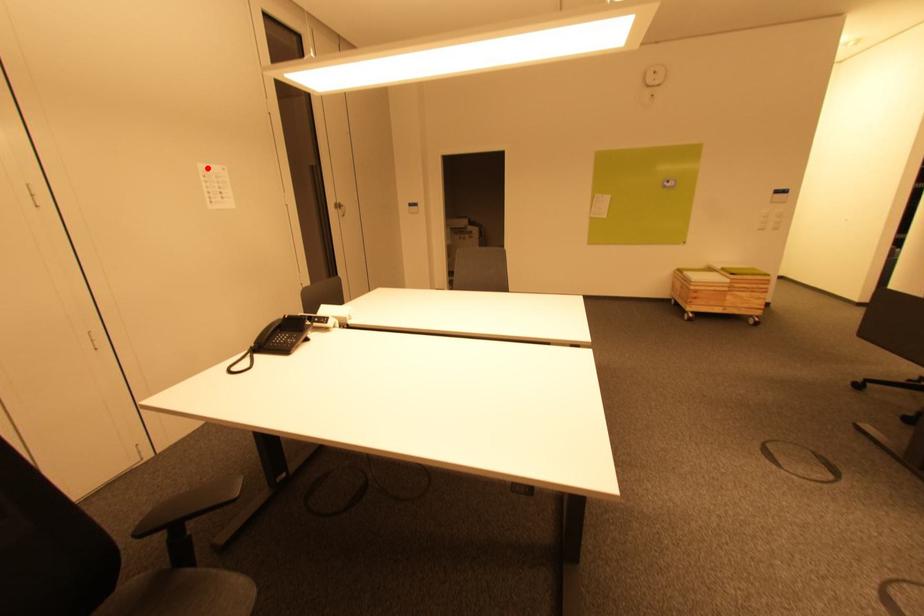
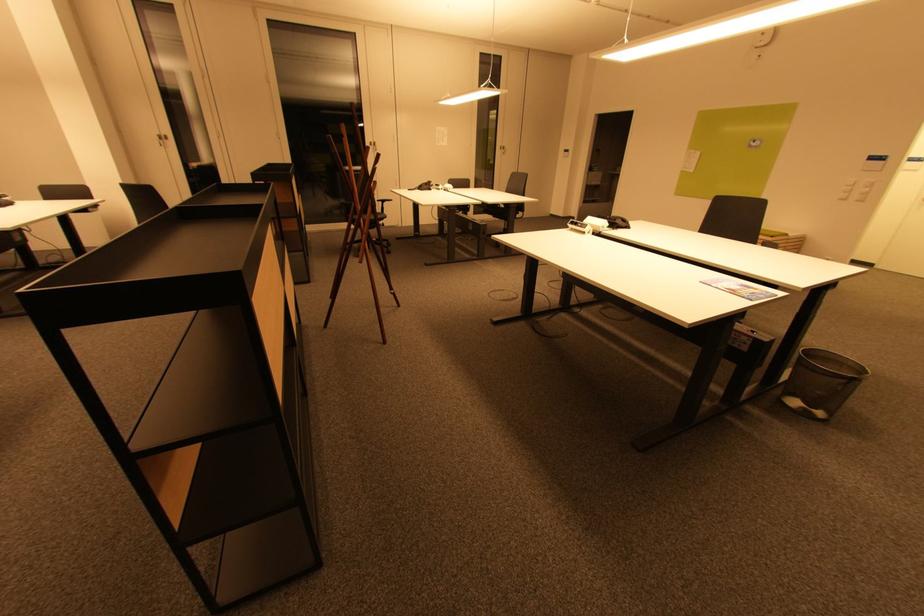
Find the pixel in the second image that matches the highlighted location in the first image.

(442, 130)